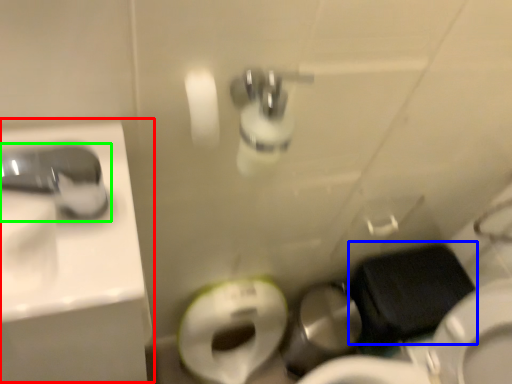
Question: Which is farther away from sink (highlighted by a red box)? sit (highlighted by a blue box) or tap (highlighted by a green box)?

Choices:
 (A) sit
 (B) tap

Answer: (A)